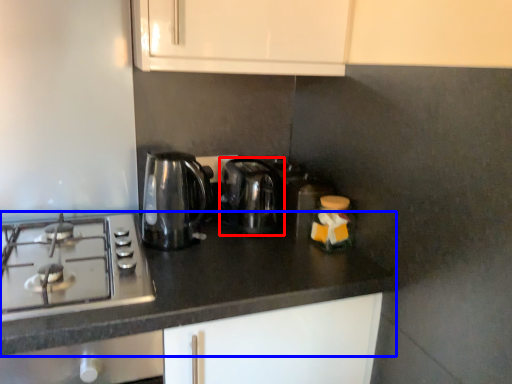
Question: Which object is further to the camera taking this photo, kitchen appliance (highlighted by a red box) or countertop (highlighted by a blue box)?

Choices:
 (A) kitchen appliance
 (B) countertop

Answer: (A)